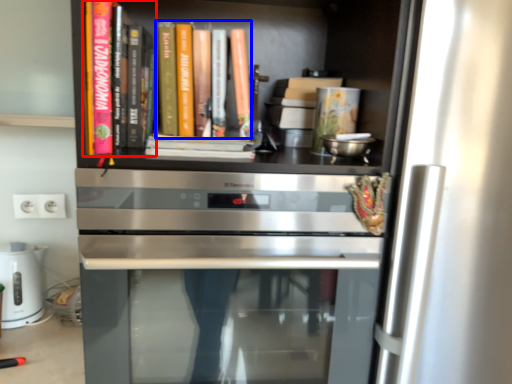
Question: Which of the following is the closest to the observer, book (highlighted by a red box) or book (highlighted by a blue box)?

Choices:
 (A) book
 (B) book

Answer: (A)